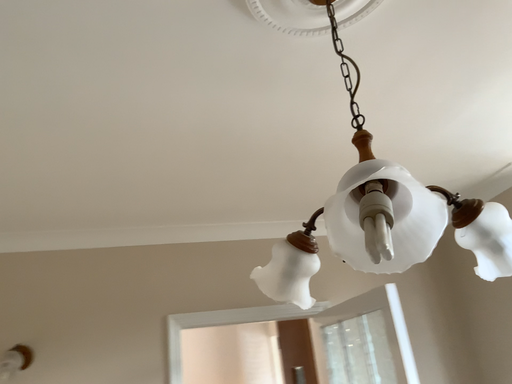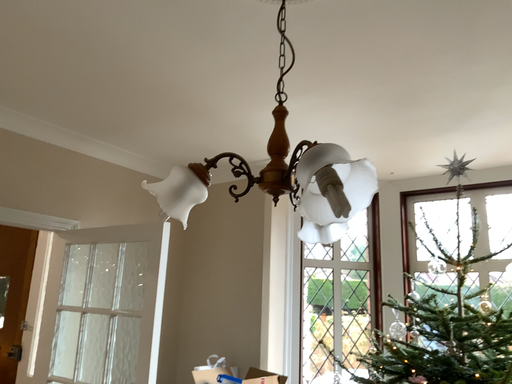
Question: How did the camera likely rotate when shooting the video?

Choices:
 (A) rotated right
 (B) rotated left

Answer: (A)